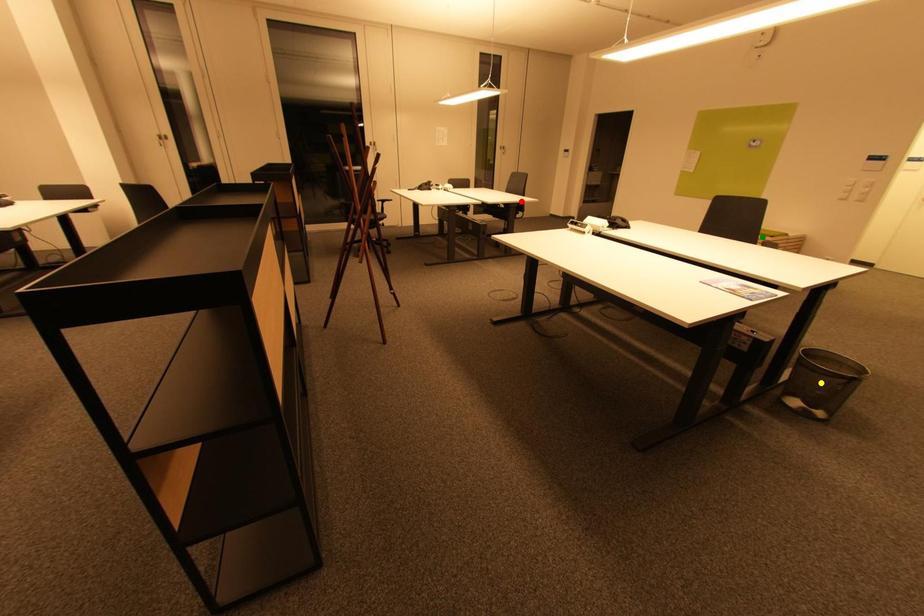
Order these from farthest to nearest:
A) yellow point
B) green point
C) red point

red point
green point
yellow point